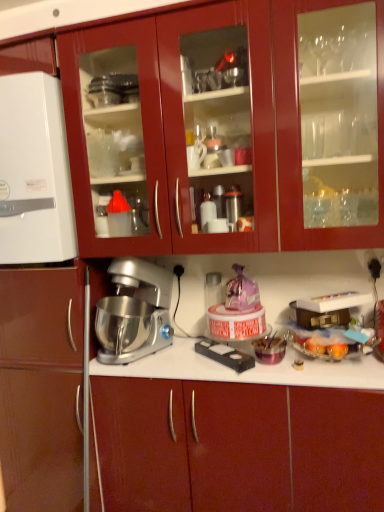
The image size is (384, 512). What do you see at coordinates (329, 327) in the screenshot?
I see `translucent plastic tray at right, which ranks as the 2th appliance in left-to-right order` at bounding box center [329, 327].

Identify the location of matte red cabinet at center, the 1th cabinetry in the bottom-to-top sequence. This screenshot has height=512, width=384. (268, 446).

You are a GUI agent. You are given a task and a screenshot of the screen. Output one action in this format:
    pyautogui.click(x=<x>, y=<y>)
    Task: Click on the translucent plastic tray at right, the second appliance positioned from the top
    Image resolution: width=384 pixels, height=512 pixels.
    Given the screenshot: What is the action you would take?
    pyautogui.click(x=329, y=327)

Between white matte refrigerator at left, which is the 2th appliance from bottom to top, and translucent plastic tray at right, the second appliance positioned from the top, which one appears on the right side from the viewer's perspective?

translucent plastic tray at right, the second appliance positioned from the top, is more to the right.

From the image's perspective, is white matte refrigerator at left, marked as the second appliance in a right-to-left arrangement, above or below translucent plastic tray at right, the second appliance positioned from the top?

Based on their image positions, white matte refrigerator at left, marked as the second appliance in a right-to-left arrangement, is located above translucent plastic tray at right, the second appliance positioned from the top.

Is white matte refrigerator at left, marked as the second appliance in a right-to-left arrangement, oriented away from translucent plastic tray at right, acting as the 1th appliance starting from the right?

No, white matte refrigerator at left, marked as the second appliance in a right-to-left arrangement, is not facing the opposite direction of translucent plastic tray at right, acting as the 1th appliance starting from the right.

From their relative heights in the image, would you say white matte refrigerator at left, marked as the second appliance in a right-to-left arrangement, is taller or shorter than translucent plastic tray at right, the second appliance positioned from the top?

Clearly, white matte refrigerator at left, marked as the second appliance in a right-to-left arrangement, is taller compared to translucent plastic tray at right, the second appliance positioned from the top.

Between white matte refrigerator at left, marked as the second appliance in a right-to-left arrangement, and silver metallic stand mixer at center, which one has less height?

With less height is silver metallic stand mixer at center.

Can you confirm if white matte refrigerator at left, which is counted as the 1th appliance, starting from the top, is positioned to the right of silver metallic stand mixer at center?

In fact, white matte refrigerator at left, which is counted as the 1th appliance, starting from the top, is to the left of silver metallic stand mixer at center.

Is silver metallic stand mixer at center not near translucent plastic tray at right, which ranks as the 2th appliance in left-to-right order?

No, silver metallic stand mixer at center is not far away from translucent plastic tray at right, which ranks as the 2th appliance in left-to-right order.

From a real-world perspective, which is physically below, silver metallic stand mixer at center or translucent plastic tray at right, acting as the 1th appliance starting from the right?

In real-world perspective, translucent plastic tray at right, acting as the 1th appliance starting from the right, is lower.

From the image's perspective, does silver metallic stand mixer at center appear higher than translucent plastic tray at right, acting as the 1th appliance starting from the right?

Yes.

Which is more to the right, silver metallic stand mixer at center or matte red cabinet at center, the 1th cabinetry in the bottom-to-top sequence?

From the viewer's perspective, matte red cabinet at center, the 1th cabinetry in the bottom-to-top sequence, appears more on the right side.

Is silver metallic stand mixer at center oriented towards matte red cabinet at center, the 2th cabinetry positioned from the top?

No, silver metallic stand mixer at center does not turn towards matte red cabinet at center, the 2th cabinetry positioned from the top.

Measure the distance from silver metallic stand mixer at center to matte red cabinet at center, the 2th cabinetry positioned from the top.

silver metallic stand mixer at center is 18.49 inches from matte red cabinet at center, the 2th cabinetry positioned from the top.

From the image's perspective, which one is positioned higher, silver metallic stand mixer at center or matte red cabinet at center, the 2th cabinetry positioned from the top?

silver metallic stand mixer at center.

Is glossy wood cabinets at upper center, the 1th cabinetry viewed from the top, surrounding matte red cabinet at center, the 1th cabinetry in the bottom-to-top sequence?

No, matte red cabinet at center, the 1th cabinetry in the bottom-to-top sequence, is not a part of glossy wood cabinets at upper center, the 1th cabinetry viewed from the top.

Considering the relative positions of glossy wood cabinets at upper center, arranged as the 2th cabinetry when ordered from the bottom, and matte red cabinet at center, the 2th cabinetry positioned from the top, in the image provided, is glossy wood cabinets at upper center, arranged as the 2th cabinetry when ordered from the bottom, to the left of matte red cabinet at center, the 2th cabinetry positioned from the top, from the viewer's perspective?

Correct, you'll find glossy wood cabinets at upper center, arranged as the 2th cabinetry when ordered from the bottom, to the left of matte red cabinet at center, the 2th cabinetry positioned from the top.

Does glossy wood cabinets at upper center, arranged as the 2th cabinetry when ordered from the bottom, have a larger size compared to matte red cabinet at center, the 2th cabinetry positioned from the top?

No.

Can you confirm if glossy wood cabinets at upper center, arranged as the 2th cabinetry when ordered from the bottom, is shorter than matte red cabinet at center, the 2th cabinetry positioned from the top?

Yes, glossy wood cabinets at upper center, arranged as the 2th cabinetry when ordered from the bottom, is shorter than matte red cabinet at center, the 2th cabinetry positioned from the top.

Would you say translucent plastic tray at right, acting as the 1th appliance starting from the right, is inside or outside silver metallic stand mixer at center?

translucent plastic tray at right, acting as the 1th appliance starting from the right, is outside silver metallic stand mixer at center.

Is translucent plastic tray at right, the 1th appliance ordered from the bottom, looking in the opposite direction of silver metallic stand mixer at center?

translucent plastic tray at right, the 1th appliance ordered from the bottom, is not turned away from silver metallic stand mixer at center.

Locate an element on the screen. appliance lying on the right of silver metallic stand mixer at center is located at coordinates (329, 327).

From a real-world perspective, is glossy wood cabinets at upper center, arranged as the 2th cabinetry when ordered from the bottom, physically below silver metallic stand mixer at center?

No.

Is point (173, 77) behind point (127, 262)?

No.

Is glossy wood cabinets at upper center, arranged as the 2th cabinetry when ordered from the bottom, further to the viewer compared to silver metallic stand mixer at center?

No, glossy wood cabinets at upper center, arranged as the 2th cabinetry when ordered from the bottom, is closer to the viewer.

Would you say glossy wood cabinets at upper center, arranged as the 2th cabinetry when ordered from the bottom, is to the left or to the right of silver metallic stand mixer at center in the picture?

Clearly, glossy wood cabinets at upper center, arranged as the 2th cabinetry when ordered from the bottom, is on the right of silver metallic stand mixer at center in the image.

Image resolution: width=384 pixels, height=512 pixels. I want to click on appliance above the translucent plastic tray at right, acting as the 1th appliance starting from the right (from the image's perspective), so click(34, 172).

The height and width of the screenshot is (512, 384). Find the location of `mixer below the white matte refrigerator at left, marked as the second appliance in a right-to-left arrangement (from the image's perspective)`. mixer below the white matte refrigerator at left, marked as the second appliance in a right-to-left arrangement (from the image's perspective) is located at coordinates (136, 310).

When comparing their distances from white matte refrigerator at left, which is the 2th appliance from bottom to top, does translucent plastic tray at right, the 1th appliance ordered from the bottom, or matte red cabinet at center, the 1th cabinetry in the bottom-to-top sequence, seem closer?

Among the two, matte red cabinet at center, the 1th cabinetry in the bottom-to-top sequence, is located nearer to white matte refrigerator at left, which is the 2th appliance from bottom to top.

Estimate the real-world distances between objects in this image. Which object is further from glossy wood cabinets at upper center, arranged as the 2th cabinetry when ordered from the bottom, silver metallic stand mixer at center or white matte refrigerator at left, which is counted as the 1th appliance, starting from the top?

silver metallic stand mixer at center.

Which object lies further to the anchor point translucent plastic tray at right, the second appliance positioned from the top, white matte refrigerator at left, which is the 2th appliance from bottom to top, or silver metallic stand mixer at center?

Based on the image, white matte refrigerator at left, which is the 2th appliance from bottom to top, appears to be further to translucent plastic tray at right, the second appliance positioned from the top.

From the image, which object appears to be nearer to matte red cabinet at center, the 2th cabinetry positioned from the top, silver metallic stand mixer at center or translucent plastic tray at right, the second appliance positioned from the top?

translucent plastic tray at right, the second appliance positioned from the top, is closer to matte red cabinet at center, the 2th cabinetry positioned from the top.

Looking at the image, which one is located further to matte red cabinet at center, the 1th cabinetry in the bottom-to-top sequence, translucent plastic tray at right, which ranks as the 2th appliance in left-to-right order, or glossy wood cabinets at upper center, arranged as the 2th cabinetry when ordered from the bottom?

glossy wood cabinets at upper center, arranged as the 2th cabinetry when ordered from the bottom, lies further to matte red cabinet at center, the 1th cabinetry in the bottom-to-top sequence, than the other object.

Looking at the image, which one is located further to glossy wood cabinets at upper center, the 1th cabinetry viewed from the top, translucent plastic tray at right, the second appliance positioned from the top, or white matte refrigerator at left, marked as the second appliance in a right-to-left arrangement?

translucent plastic tray at right, the second appliance positioned from the top, is further to glossy wood cabinets at upper center, the 1th cabinetry viewed from the top.

When comparing their distances from silver metallic stand mixer at center, does translucent plastic tray at right, the second appliance positioned from the top, or matte red cabinet at center, the 2th cabinetry positioned from the top, seem closer?

matte red cabinet at center, the 2th cabinetry positioned from the top, lies closer to silver metallic stand mixer at center than the other object.

When comparing their distances from matte red cabinet at center, the 2th cabinetry positioned from the top, does glossy wood cabinets at upper center, arranged as the 2th cabinetry when ordered from the bottom, or translucent plastic tray at right, the second appliance positioned from the top, seem further?

The object further to matte red cabinet at center, the 2th cabinetry positioned from the top, is glossy wood cabinets at upper center, arranged as the 2th cabinetry when ordered from the bottom.

The image size is (384, 512). In order to click on mixer between white matte refrigerator at left, which is the 2th appliance from bottom to top, and glossy wood cabinets at upper center, arranged as the 2th cabinetry when ordered from the bottom, from left to right in this screenshot , I will do `click(136, 310)`.

The width and height of the screenshot is (384, 512). In order to click on mixer situated between white matte refrigerator at left, which is counted as the 1th appliance, starting from the top, and translucent plastic tray at right, which ranks as the 2th appliance in left-to-right order, from left to right in this screenshot , I will do `click(136, 310)`.

This screenshot has height=512, width=384. Identify the location of mixer between glossy wood cabinets at upper center, the 1th cabinetry viewed from the top, and translucent plastic tray at right, which ranks as the 2th appliance in left-to-right order, from top to bottom. (136, 310).

Identify the location of mixer between white matte refrigerator at left, the 1th appliance viewed from the left, and matte red cabinet at center, the 2th cabinetry positioned from the top, in the up-down direction. (136, 310).